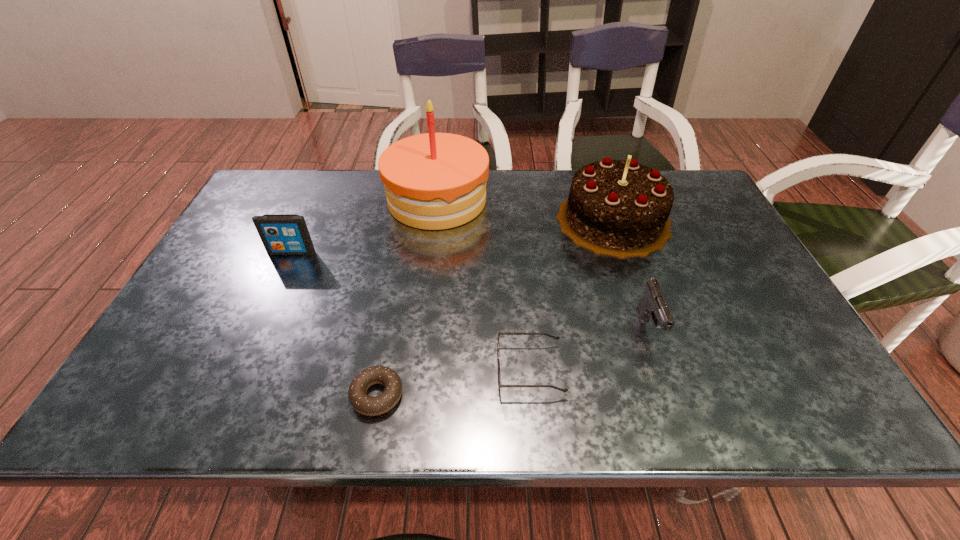
Locate an element on the screen. This screenshot has height=540, width=960. empty location between the fourth object from left to right and the shortest object is located at coordinates (453, 382).

Locate an element on the screen. This screenshot has width=960, height=540. empty space between the taller birthday cake and the pistol is located at coordinates (543, 263).

Image resolution: width=960 pixels, height=540 pixels. I want to click on free area in between the doughnut and the pistol, so click(x=514, y=361).

This screenshot has width=960, height=540. I want to click on unoccupied area between the pistol and the tallest object, so click(x=543, y=263).

You are a GUI agent. You are given a task and a screenshot of the screen. Output one action in this format:
    pyautogui.click(x=<x>, y=<y>)
    Task: Click on the free space that is in between the shorter birthday cake and the iPod
    
    Given the screenshot: What is the action you would take?
    pyautogui.click(x=453, y=236)

Find the location of a particular element. This screenshot has width=960, height=540. free space between the doughnut and the pistol is located at coordinates (514, 361).

You are a GUI agent. You are given a task and a screenshot of the screen. Output one action in this format:
    pyautogui.click(x=<x>, y=<y>)
    Task: Click on the blank region between the pistol and the right birthday cake
    The width and height of the screenshot is (960, 540).
    Given the screenshot: What is the action you would take?
    pyautogui.click(x=632, y=273)

You are a GUI agent. You are given a task and a screenshot of the screen. Output one action in this format:
    pyautogui.click(x=<x>, y=<y>)
    Task: Click on the free space between the second shortest object and the leftmost object
    This screenshot has height=540, width=960.
    Given the screenshot: What is the action you would take?
    pyautogui.click(x=411, y=311)

The height and width of the screenshot is (540, 960). I want to click on vacant area that lies between the shorter birthday cake and the iPod, so click(x=453, y=236).

Identify which object is located as the nearest to the pistol. Please provide its 2D coordinates. Your answer should be formatted as a tuple, i.e. [(x, y)], where the tuple contains the x and y coordinates of a point satisfying the conditions above.

[(619, 208)]